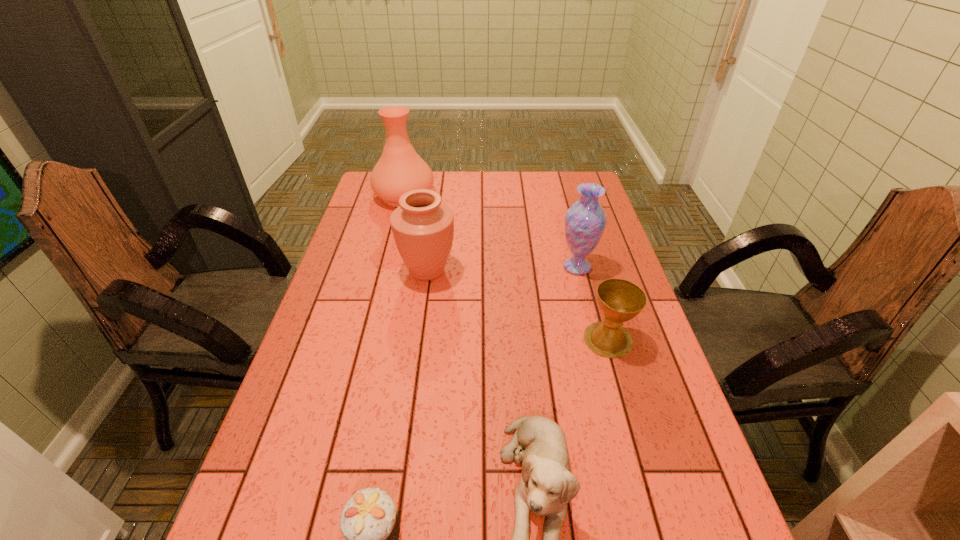
This screenshot has height=540, width=960. I want to click on the farthest vase, so click(x=400, y=169).

Image resolution: width=960 pixels, height=540 pixels. I want to click on the farthest object, so [400, 169].

This screenshot has height=540, width=960. In order to click on the rightmost vase in this screenshot , I will do `click(585, 221)`.

I want to click on the third nearest object, so click(619, 300).

Where is `free location located 0.280m on the front of the tallest object`? free location located 0.280m on the front of the tallest object is located at coordinates (388, 262).

What are the coordinates of `vacant area located 0.130m on the left of the rightmost vase` in the screenshot? It's located at (516, 267).

You are a GUI agent. You are given a task and a screenshot of the screen. Output one action in this format:
    pyautogui.click(x=<x>, y=<y>)
    Task: Click on the free space located 0.250m on the left of the fourth farthest object
    The width and height of the screenshot is (960, 540).
    Given the screenshot: What is the action you would take?
    pyautogui.click(x=487, y=339)

This screenshot has width=960, height=540. I want to click on object that is at the far edge, so click(x=400, y=169).

This screenshot has width=960, height=540. Identify the location of object that is at the left edge. (400, 169).

The image size is (960, 540). What are the coordinates of `vase positioned at the right edge` in the screenshot? It's located at (585, 221).